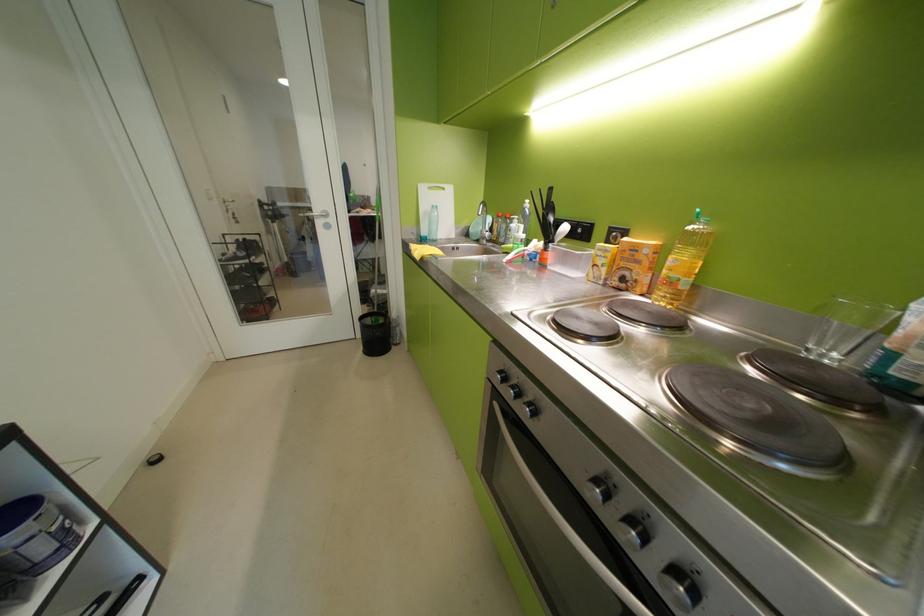
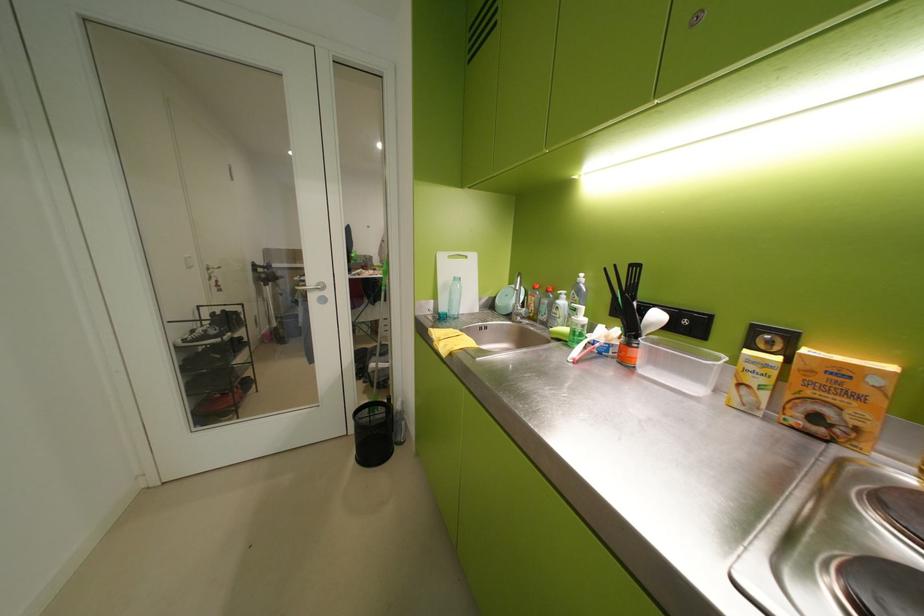
Locate, in the second image, the point that corresponds to point 616,252 in the first image.

(773, 365)